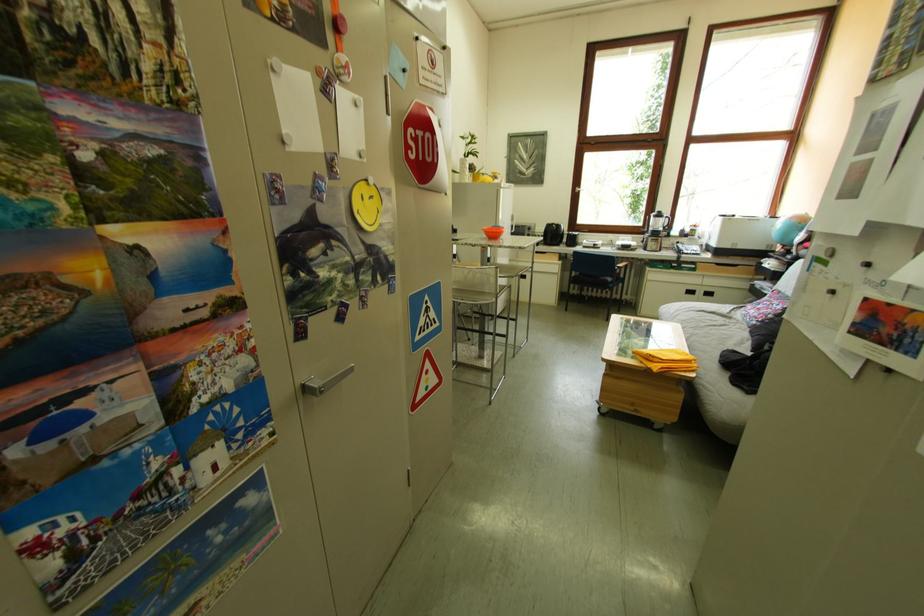
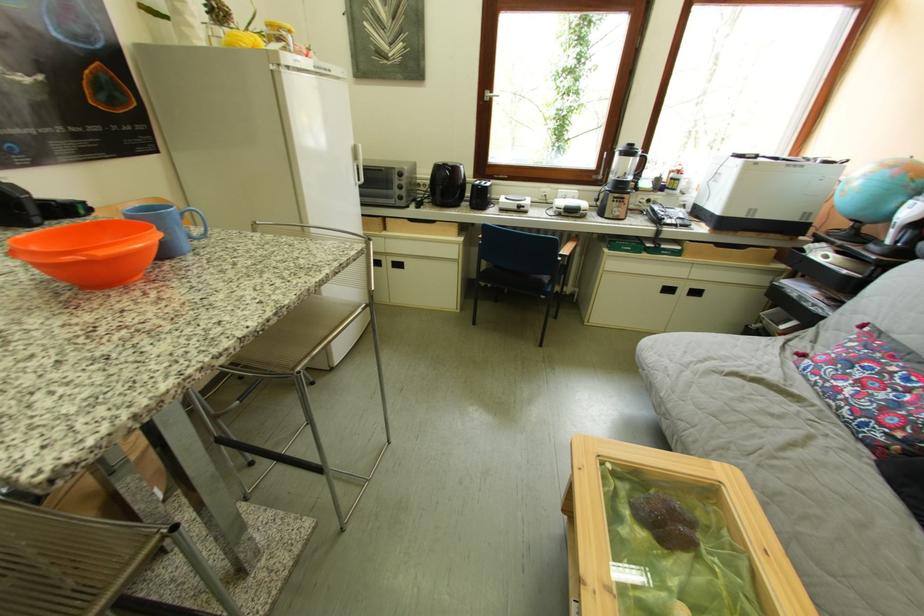
Find the pixel in the second image that matches point (666, 251) in the first image.

(629, 217)